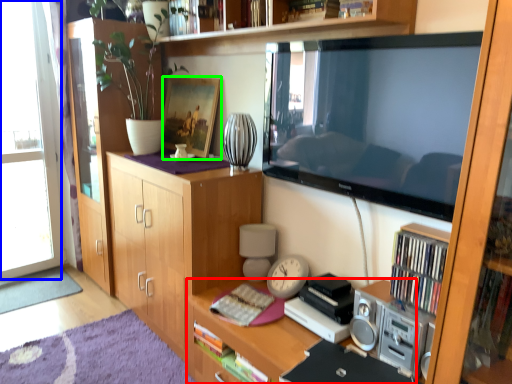
Question: Which object is the closest to the desk (highlighted by a red box)? Choose among these: window (highlighted by a blue box) or picture frame (highlighted by a green box).

Choices:
 (A) window
 (B) picture frame

Answer: (B)